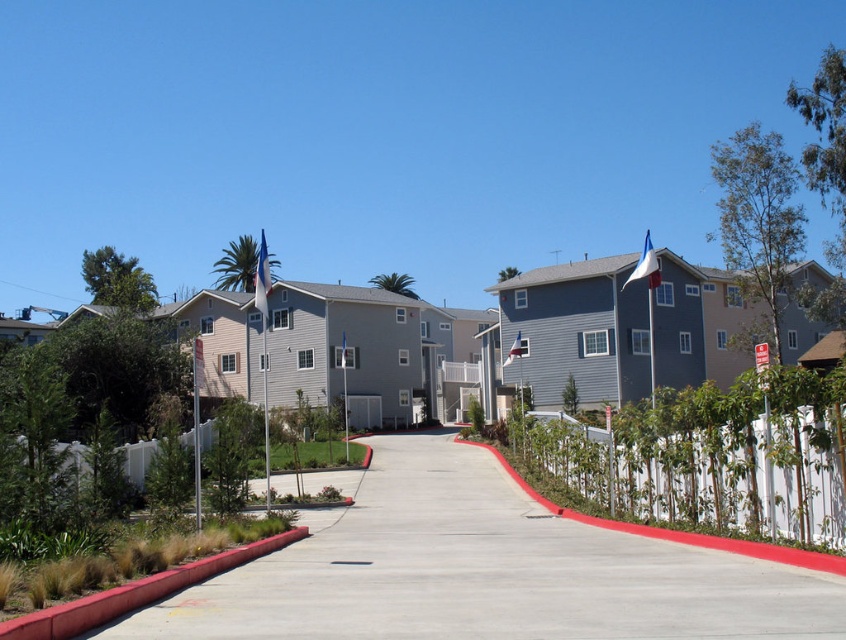
You are standing at the entrance of the residential area and want to walk to the concrete at center. According to the image, in which direction should you head?

The concrete at center is located at point [482,570] in the image, so you should head towards the center of the image to reach it.

You are a delivery driver approaching the house and need to park on the concrete at center. The white wood fence at center right is blocking the parking spot. Can you drive around the fence to the right to reach the parking area?

The concrete at center is to the left of white wood fence at center right, so driving around the fence to the right would take you away from the parking area. You should instead go left towards the concrete at center to park.